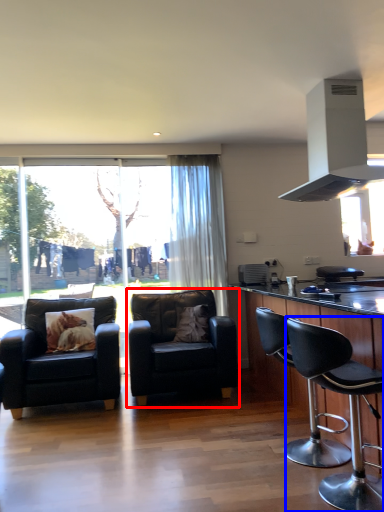
Question: Which object appears closest to the camera in this image, chair (highlighted by a red box) or chair (highlighted by a blue box)?

Choices:
 (A) chair
 (B) chair

Answer: (B)